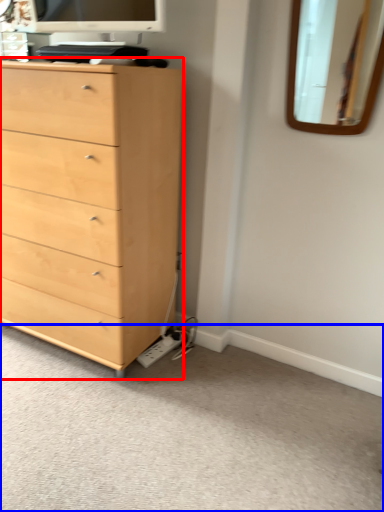
Question: Which of the following is the farthest to the observer, chest of drawers (highlighted by a red box) or plain (highlighted by a blue box)?

Choices:
 (A) chest of drawers
 (B) plain

Answer: (A)